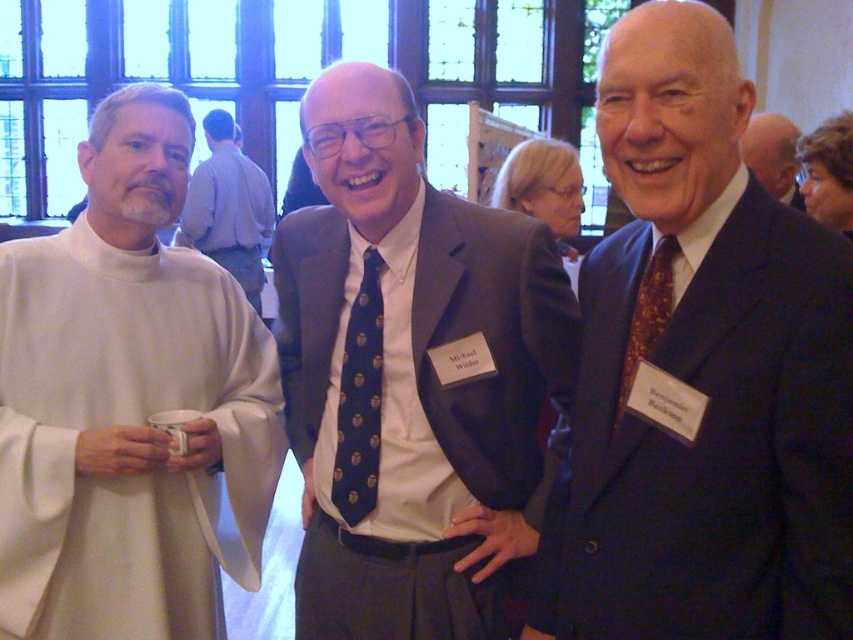
Question: Does light beige tunic at left appear on the right side of blue dotted tie at center?

Choices:
 (A) yes
 (B) no

Answer: (B)

Question: Among these objects, which one is nearest to the camera?

Choices:
 (A) blue dotted tie at center
 (B) brown textured tie at right
 (C) dark blue tie at center
 (D) dark blue suit at center

Answer: (D)

Question: Does light beige tunic at left appear on the left side of blue dotted tie at center?

Choices:
 (A) yes
 (B) no

Answer: (A)

Question: Which of the following is the farthest from the observer?

Choices:
 (A) dark blue tie at center
 (B) brown textured tie at right

Answer: (A)

Question: Is light beige tunic at left positioned before brown textured tie at right?

Choices:
 (A) yes
 (B) no

Answer: (A)

Question: Which point is closer to the camera?

Choices:
 (A) (97, 616)
 (B) (845, 554)
 (C) (374, 452)
 (D) (196, 212)

Answer: (B)